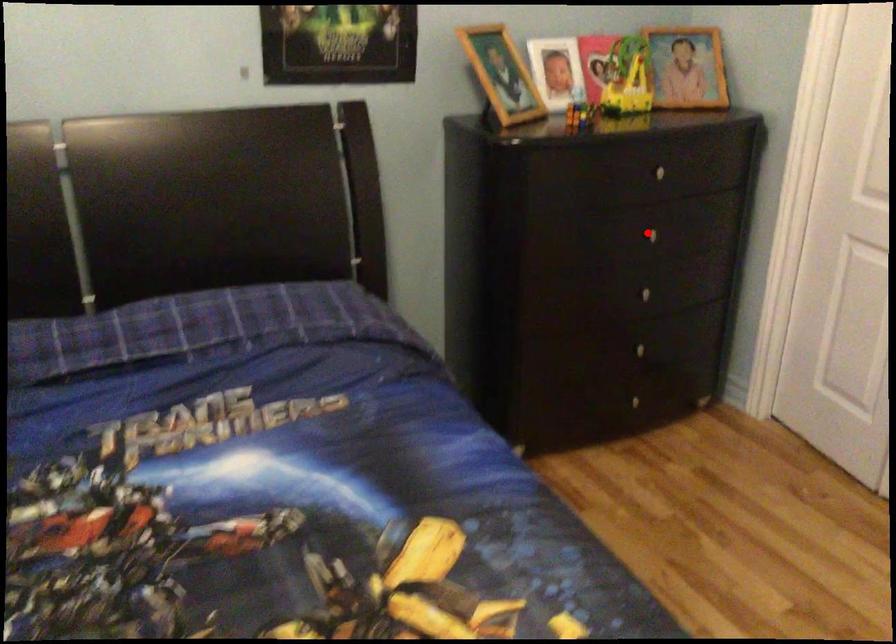
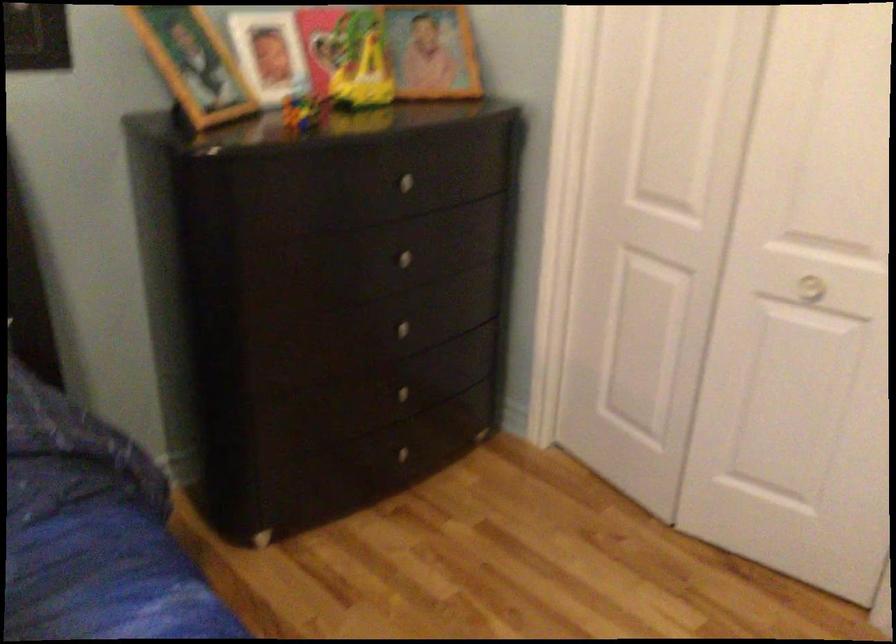
Question: I am providing you with two images of the same scene from different viewpoints. A red point is marked on the first image. Can you still see the location of the red point in image 2?

Choices:
 (A) Yes
 (B) No

Answer: (A)